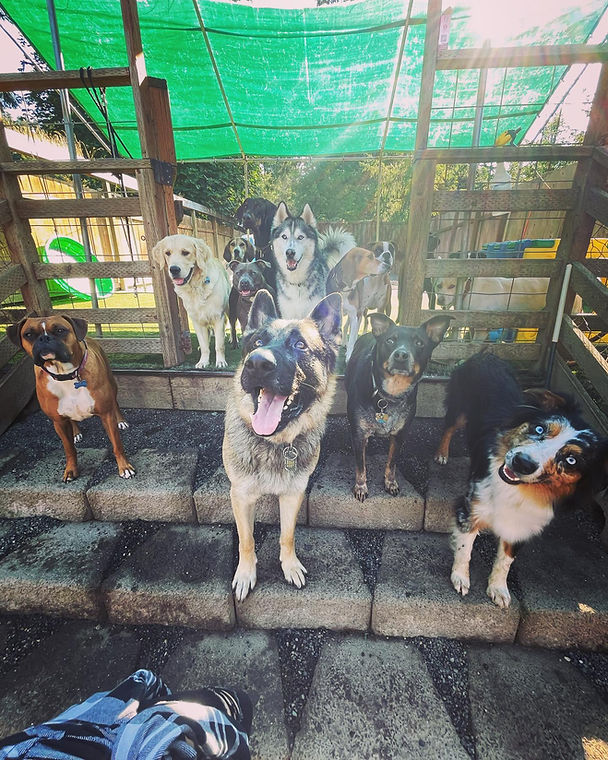
This screenshot has width=608, height=760. I want to click on wooden barrier, left side center, so 152,147, 149,340, 122,271, 126,264, 112,220, 115,80.